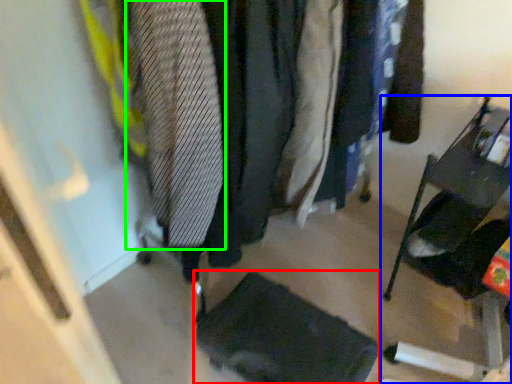
Question: Which object is positioned farthest from footrest (highlighted by a red box)? Select from furniture (highlighted by a blue box) and tie (highlighted by a green box).

Choices:
 (A) furniture
 (B) tie

Answer: (B)